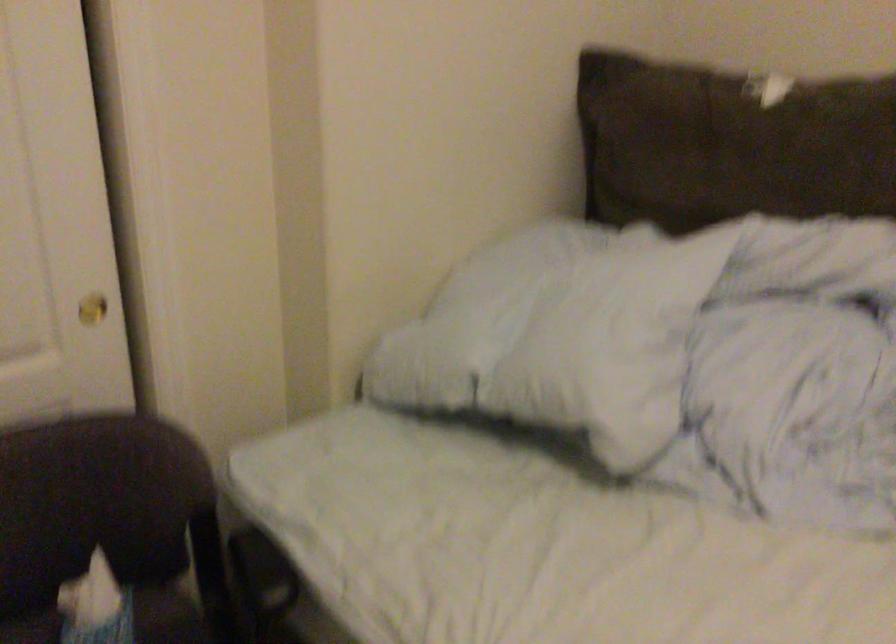
Where would you turn the gold door knob? Please return your answer as a coordinate pair (x, y).

(91, 308)